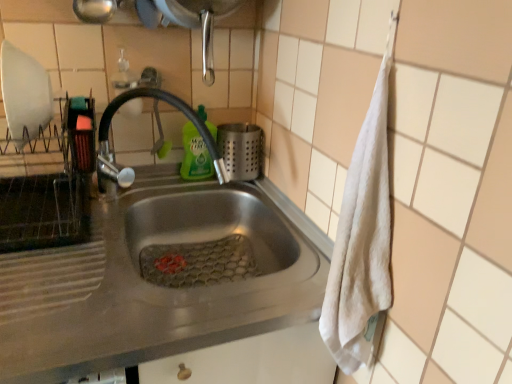
Measure the distance between point [181,108] and camera.

90.00 centimeters.

What is the approximate height of green liquid at sink?

It is 8.43 inches.

The image size is (512, 384). Find the location of `shiny metallic faucet at center`. shiny metallic faucet at center is located at coordinates (170, 105).

Between stainless steel sink at center and satin silver utensil holder at sink, which one has smaller size?

satin silver utensil holder at sink.

Does stainless steel sink at center have a lesser width compared to satin silver utensil holder at sink?

In fact, stainless steel sink at center might be wider than satin silver utensil holder at sink.

Does point (166, 311) lie behind point (237, 149)?

That is False.

How different are the orientations of stainless steel sink at center and satin silver utensil holder at sink in degrees?

The angular difference between stainless steel sink at center and satin silver utensil holder at sink is 0.0334 degrees.

Which is more to the left, green liquid at sink or stainless steel sink at center?

stainless steel sink at center.

Based on the photo, is green liquid at sink spatially inside stainless steel sink at center, or outside of it?

green liquid at sink is outside stainless steel sink at center.

Is green liquid at sink looking in the opposite direction of stainless steel sink at center?

green liquid at sink does not have its back to stainless steel sink at center.

Is green liquid at sink far away from stainless steel sink at center?

No, green liquid at sink is not far from stainless steel sink at center.

Between satin silver utensil holder at sink and stainless steel sink at center, which one is positioned in front?

Positioned in front is stainless steel sink at center.

In order to click on sink beneath the satin silver utensil holder at sink (from a real-world perspective) in this screenshot , I will do `click(144, 266)`.

Is satin silver utensil holder at sink surrounding stainless steel sink at center?

Definitely not — stainless steel sink at center is not inside satin silver utensil holder at sink.

How far apart are satin silver utensil holder at sink and stainless steel sink at center?

satin silver utensil holder at sink is 11.84 inches from stainless steel sink at center.

Is stainless steel sink at center turned away from shiny metallic faucet at center?

stainless steel sink at center is not turned away from shiny metallic faucet at center.

From a real-world perspective, who is located higher, stainless steel sink at center or shiny metallic faucet at center?

shiny metallic faucet at center is physically above.

How many degrees apart are the facing directions of stainless steel sink at center and shiny metallic faucet at center?

The angle between the facing direction of stainless steel sink at center and the facing direction of shiny metallic faucet at center is 0.0335 degrees.

Is stainless steel sink at center surrounding shiny metallic faucet at center?

Definitely not — shiny metallic faucet at center is not inside stainless steel sink at center.

In terms of size, does stainless steel sink at center appear bigger or smaller than green liquid at sink?

stainless steel sink at center is bigger than green liquid at sink.

Choose the correct answer: Is stainless steel sink at center inside green liquid at sink or outside it?

stainless steel sink at center is outside green liquid at sink.

Based on the photo, does stainless steel sink at center turn towards green liquid at sink?

No.

How different are the orientations of stainless steel sink at center and green liquid at sink in degrees?

The angle between the facing direction of stainless steel sink at center and the facing direction of green liquid at sink is 0.0339 degrees.

Which object is positioned more to the left, green liquid at sink or shiny metallic faucet at center?

From the viewer's perspective, shiny metallic faucet at center appears more on the left side.

Considering the sizes of green liquid at sink and shiny metallic faucet at center in the image, is green liquid at sink wider or thinner than shiny metallic faucet at center?

In the image, green liquid at sink appears to be more narrow than shiny metallic faucet at center.

Which object is further away from the camera taking this photo, green liquid at sink or shiny metallic faucet at center?

green liquid at sink.

Considering the relative positions of green liquid at sink and satin silver utensil holder at sink in the image provided, is green liquid at sink to the right of satin silver utensil holder at sink from the viewer's perspective?

Incorrect, green liquid at sink is not on the right side of satin silver utensil holder at sink.

Are green liquid at sink and satin silver utensil holder at sink located far from each other?

No.

Is green liquid at sink oriented away from satin silver utensil holder at sink?

No, green liquid at sink's orientation is not away from satin silver utensil holder at sink.

How many degrees apart are the facing directions of green liquid at sink and satin silver utensil holder at sink?

The angle between the facing direction of green liquid at sink and the facing direction of satin silver utensil holder at sink is 0.00151 degrees.

Identify the location of appliance to the right of stainless steel sink at center. The height and width of the screenshot is (384, 512). (241, 150).

Where is `cleaning product that appears behind the stainless steel sink at center`? Image resolution: width=512 pixels, height=384 pixels. cleaning product that appears behind the stainless steel sink at center is located at coordinates (195, 155).

Estimate the real-world distances between objects in this image. Which object is closer to stainless steel sink at center, shiny metallic faucet at center or green liquid at sink?

shiny metallic faucet at center is closer to stainless steel sink at center.

Considering their positions, is green liquid at sink positioned closer to stainless steel sink at center than shiny metallic faucet at center?

shiny metallic faucet at center is closer to stainless steel sink at center.

In the scene shown: Considering their positions, is shiny metallic faucet at center positioned further to satin silver utensil holder at sink than stainless steel sink at center?

Among the two, stainless steel sink at center is located further to satin silver utensil holder at sink.

Looking at the image, which one is located closer to shiny metallic faucet at center, green liquid at sink or satin silver utensil holder at sink?

green liquid at sink lies closer to shiny metallic faucet at center than the other object.

Considering their positions, is satin silver utensil holder at sink positioned further to green liquid at sink than shiny metallic faucet at center?

shiny metallic faucet at center lies further to green liquid at sink than the other object.

Looking at this image, from the image, which object appears to be farther from shiny metallic faucet at center, satin silver utensil holder at sink or green liquid at sink?

satin silver utensil holder at sink lies further to shiny metallic faucet at center than the other object.

Considering their positions, is stainless steel sink at center positioned further to green liquid at sink than satin silver utensil holder at sink?

stainless steel sink at center is further to green liquid at sink.

From the image, which object appears to be nearer to stainless steel sink at center, satin silver utensil holder at sink or shiny metallic faucet at center?

shiny metallic faucet at center is closer to stainless steel sink at center.

The height and width of the screenshot is (384, 512). Find the location of `appliance between shiny metallic faucet at center and green liquid at sink along the z-axis`. appliance between shiny metallic faucet at center and green liquid at sink along the z-axis is located at coordinates (241, 150).

At what (x,y) coordinates should I click in order to perform the action: click on tap located between stainless steel sink at center and satin silver utensil holder at sink in the depth direction. Please return your answer as a coordinate pair (x, y). Looking at the image, I should click on (170, 105).

What are the coordinates of `tap located between stainless steel sink at center and green liquid at sink in the depth direction` in the screenshot? It's located at (170, 105).

Where is `appliance located between stainless steel sink at center and green liquid at sink in the depth direction`? appliance located between stainless steel sink at center and green liquid at sink in the depth direction is located at coordinates pos(241,150).